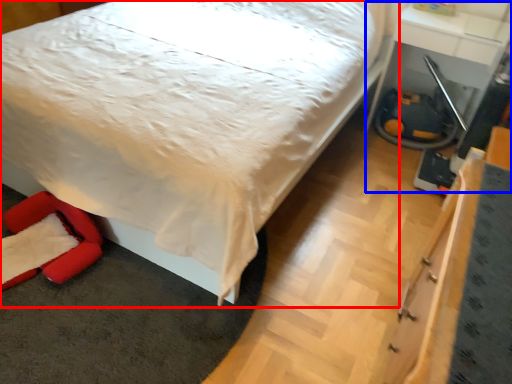
Question: Which of the following is the closest to the observer, bed (highlighted by a red box) or table (highlighted by a blue box)?

Choices:
 (A) bed
 (B) table

Answer: (A)